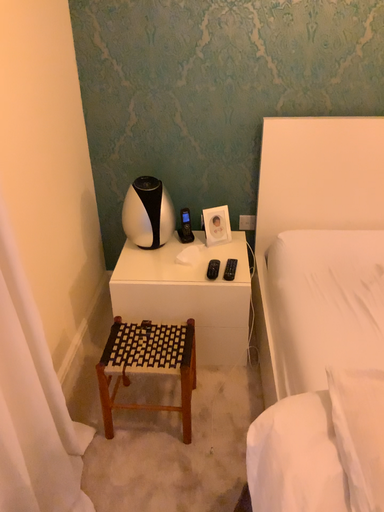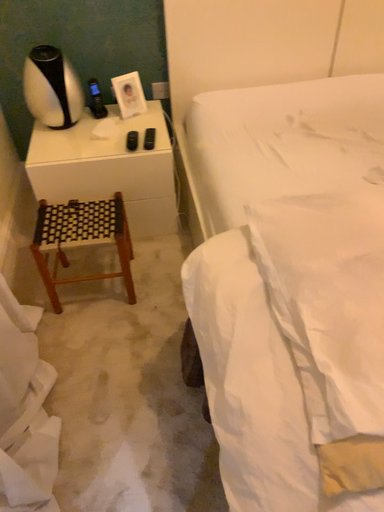
Question: Which way did the camera rotate in the video?

Choices:
 (A) rotated right
 (B) rotated left

Answer: (A)